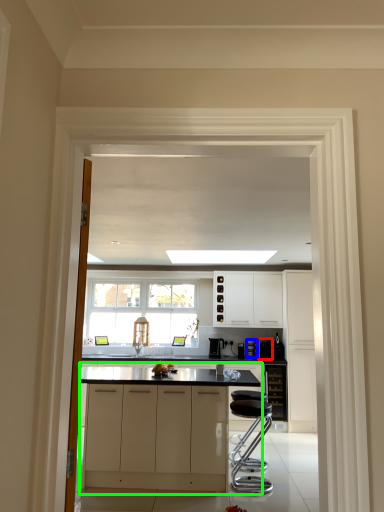
Question: Estimate the real-world distances between objects in this image. Which object is closer to appliance (highlighted by a red box), appliance (highlighted by a blue box) or cabinetry (highlighted by a green box)?

Choices:
 (A) appliance
 (B) cabinetry

Answer: (A)